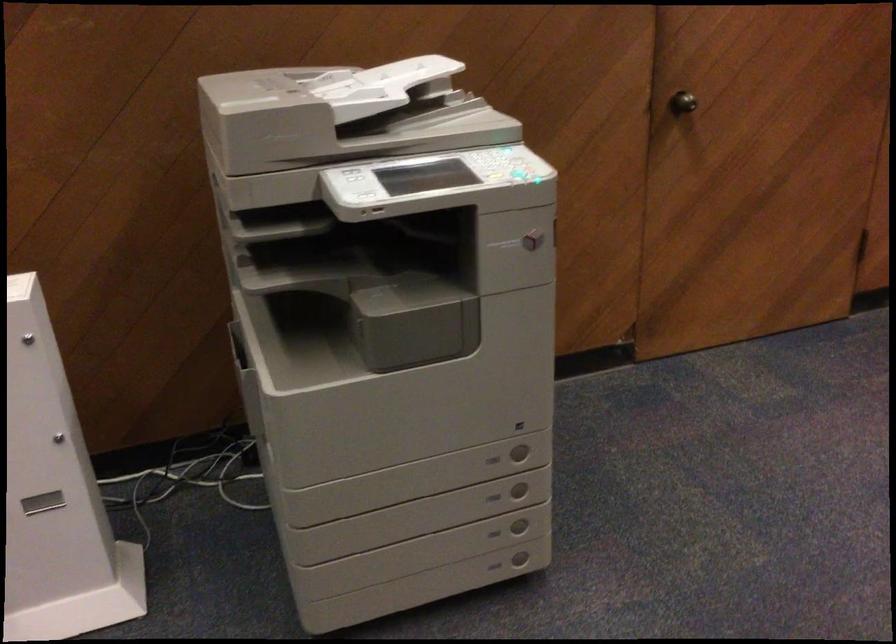
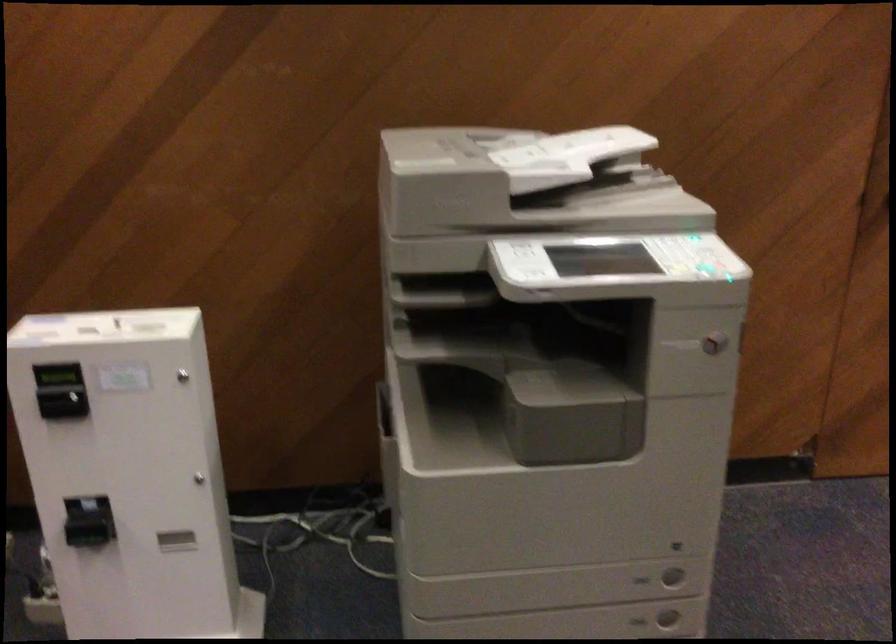
Where in the second image is the point corresponding to point (501, 500) from the first image?

(638, 621)